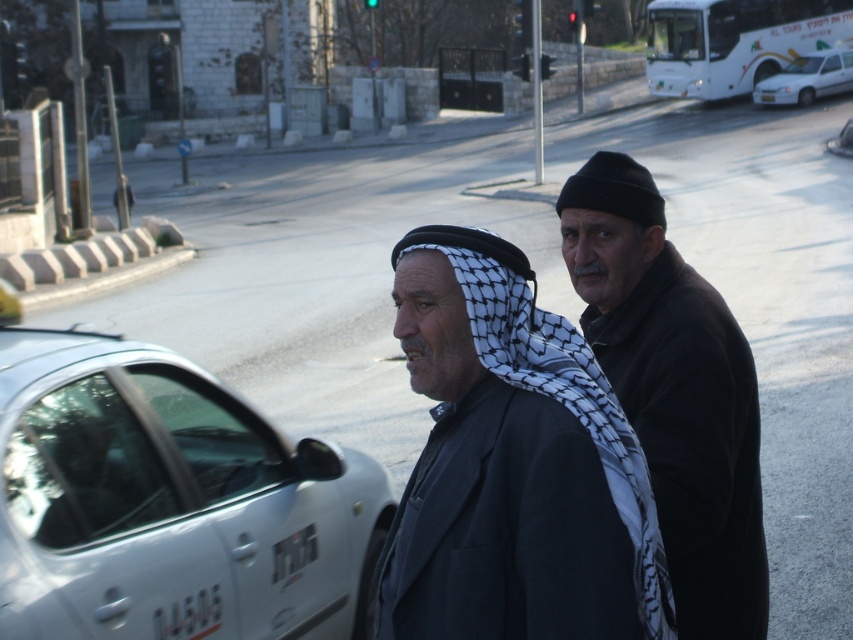
Question: Can you confirm if white glossy car at upper right is positioned below metallic silver car at right?

Choices:
 (A) no
 (B) yes

Answer: (A)

Question: Is black woolen hat at upper right further to the viewer compared to white matte bus at upper right?

Choices:
 (A) no
 (B) yes

Answer: (A)

Question: Is black matte jacket at center to the right of black woolen hat at upper right from the viewer's perspective?

Choices:
 (A) no
 (B) yes

Answer: (A)

Question: Which object appears farthest from the camera in this image?

Choices:
 (A) white glossy car at upper right
 (B) white matte car at left
 (C) black matte jacket at center

Answer: (A)

Question: Which of the following is the farthest from the observer?

Choices:
 (A) (840, 65)
 (B) (802, 17)

Answer: (B)

Question: Which point is farther to the camera?

Choices:
 (A) white glossy car at upper right
 (B) white matte bus at upper right
 (C) metallic silver car at right

Answer: (A)